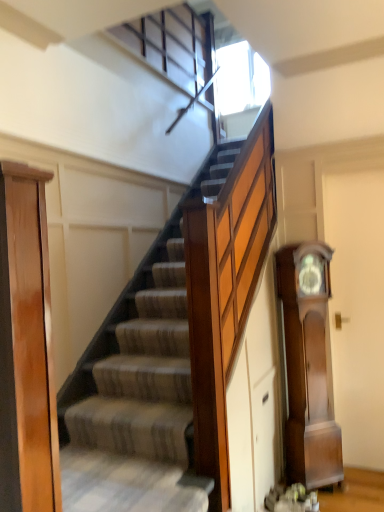
Question: Does polished wood grandfather clock at right appear on the left side of light brown wood door at left?

Choices:
 (A) no
 (B) yes

Answer: (A)

Question: Is polished wood grandfather clock at right taller than light brown wood door at left?

Choices:
 (A) yes
 (B) no

Answer: (A)

Question: Does polished wood grandfather clock at right come in front of light brown wood door at left?

Choices:
 (A) no
 (B) yes

Answer: (A)

Question: Can you confirm if polished wood grandfather clock at right is wider than light brown wood door at left?

Choices:
 (A) no
 (B) yes

Answer: (B)

Question: Is light brown wood door at left at the back of polished wood grandfather clock at right?

Choices:
 (A) no
 (B) yes

Answer: (A)

Question: From a real-world perspective, is polished wood grandfather clock at right under light brown wood door at left?

Choices:
 (A) no
 (B) yes

Answer: (B)

Question: Considering the relative positions of light brown wood door at left and polished wood grandfather clock at right in the image provided, is light brown wood door at left to the right of polished wood grandfather clock at right from the viewer's perspective?

Choices:
 (A) yes
 (B) no

Answer: (B)

Question: Would you say light brown wood door at left is a long distance from polished wood grandfather clock at right?

Choices:
 (A) no
 (B) yes

Answer: (B)

Question: Does light brown wood door at left have a larger size compared to polished wood grandfather clock at right?

Choices:
 (A) yes
 (B) no

Answer: (B)

Question: Does light brown wood door at left come behind polished wood grandfather clock at right?

Choices:
 (A) yes
 (B) no

Answer: (B)

Question: Can you confirm if light brown wood door at left is smaller than polished wood grandfather clock at right?

Choices:
 (A) yes
 (B) no

Answer: (A)

Question: From a real-world perspective, is light brown wood door at left positioned under polished wood grandfather clock at right based on gravity?

Choices:
 (A) yes
 (B) no

Answer: (B)

Question: Visually, is light brown wood door at left positioned to the left or to the right of polished wood grandfather clock at right?

Choices:
 (A) left
 (B) right

Answer: (A)